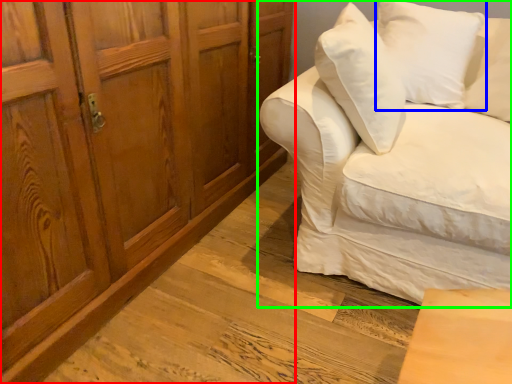
Question: Estimate the real-world distances between objects in this image. Which object is closer to cabinetry (highlighted by a red box), pillow (highlighted by a blue box) or studio couch (highlighted by a green box)?

Choices:
 (A) pillow
 (B) studio couch

Answer: (B)